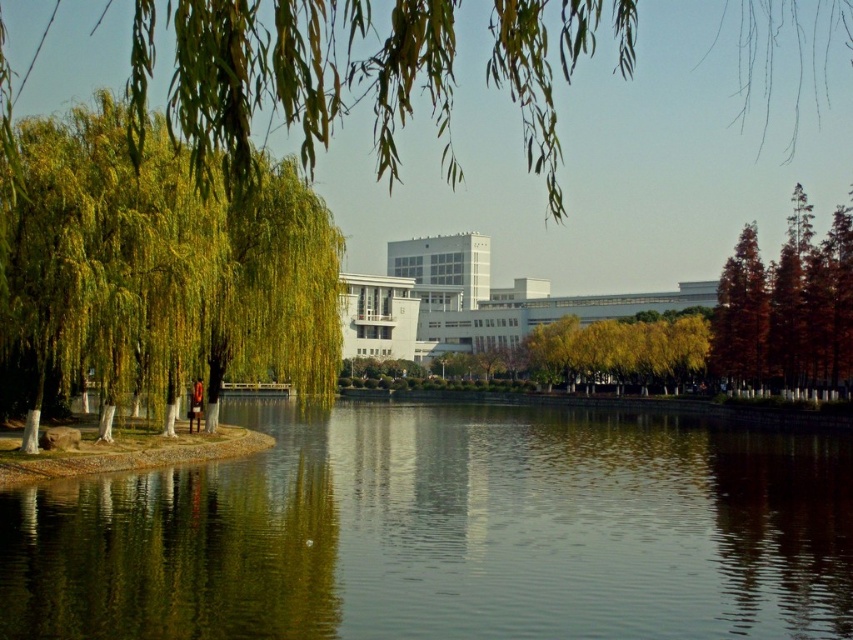
Question: Which object is positioned farthest from the green reflective water at center?

Choices:
 (A) green leafy willow at left
 (B) orange matte tree at right
 (C) reddish-brown smooth tree at right

Answer: (C)

Question: Based on their relative distances, which object is nearer to the green reflective water at center?

Choices:
 (A) reddish-brown smooth tree at right
 (B) green leafy willow at left

Answer: (B)

Question: In this image, where is orange matte tree at right located relative to reddish-brown smooth tree at right?

Choices:
 (A) right
 (B) left

Answer: (A)

Question: Is orange matte tree at right to the right of reddish-brown smooth tree at right from the viewer's perspective?

Choices:
 (A) yes
 (B) no

Answer: (A)

Question: Does green leafy willow at left have a larger size compared to reddish-brown smooth tree at right?

Choices:
 (A) yes
 (B) no

Answer: (A)

Question: Among these points, which one is nearest to the camera?

Choices:
 (A) (189, 342)
 (B) (813, 314)
 (C) (277, 428)
 (D) (763, 282)

Answer: (A)